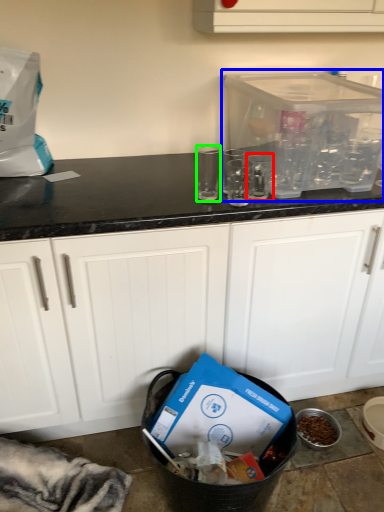
Question: Which is nearer to the clear (highlighted by a red box)? appliance (highlighted by a blue box) or clear (highlighted by a green box).

Choices:
 (A) appliance
 (B) clear

Answer: (A)